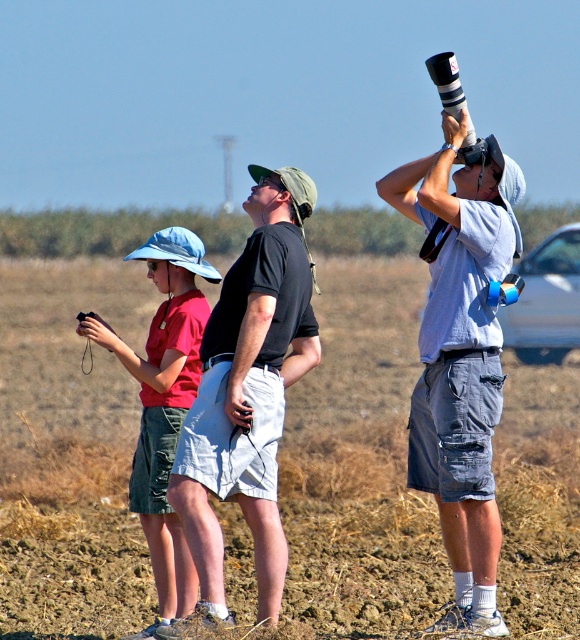
You are standing in the field and see a point marked at coordinates (x=461, y=358). Which object is this point located on?

The point at coordinates (x=461, y=358) is located on the gray cotton shirt at upper right.